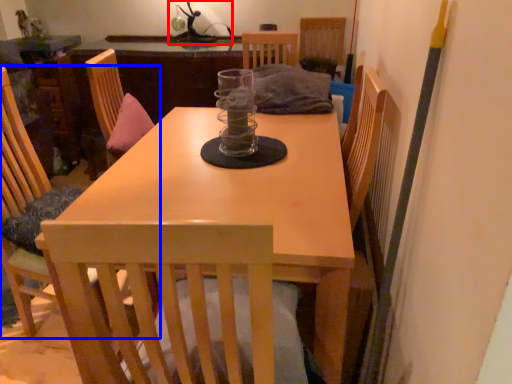
Question: Which of the following is the farthest to the observer, table lamp (highlighted by a red box) or chair (highlighted by a blue box)?

Choices:
 (A) table lamp
 (B) chair

Answer: (A)